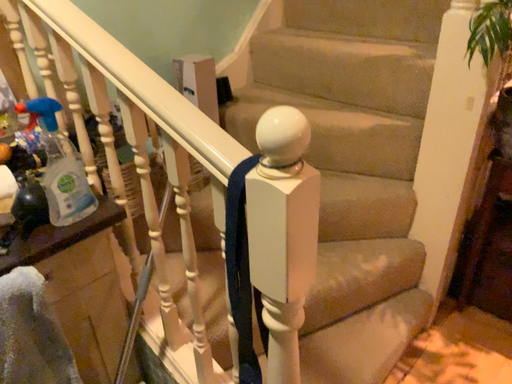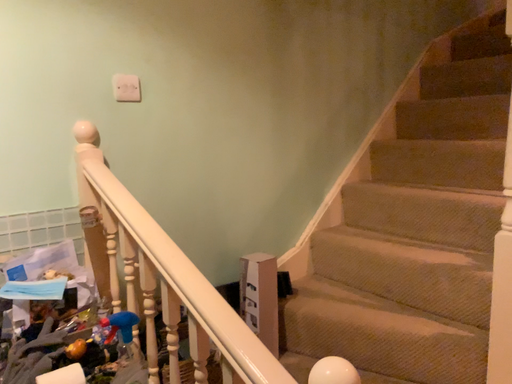
Question: Which way did the camera rotate in the video?

Choices:
 (A) rotated downward
 (B) rotated upward

Answer: (B)